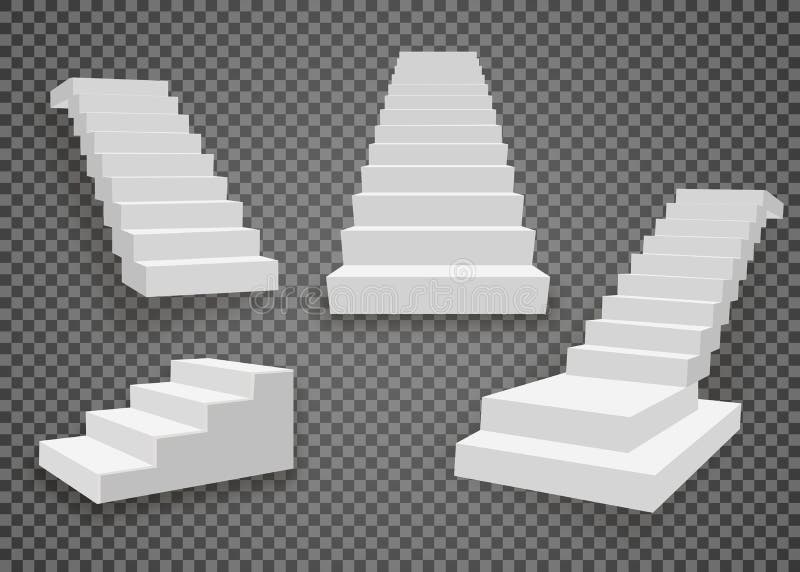
Where is `stairways`? This screenshot has width=800, height=572. stairways is located at coordinates (202, 190), (398, 193), (629, 361), (197, 420).